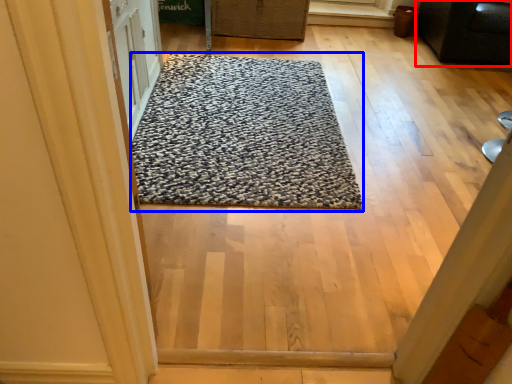
Question: Which object appears farthest to the camera in this image, furniture (highlighted by a red box) or mat (highlighted by a blue box)?

Choices:
 (A) furniture
 (B) mat

Answer: (A)